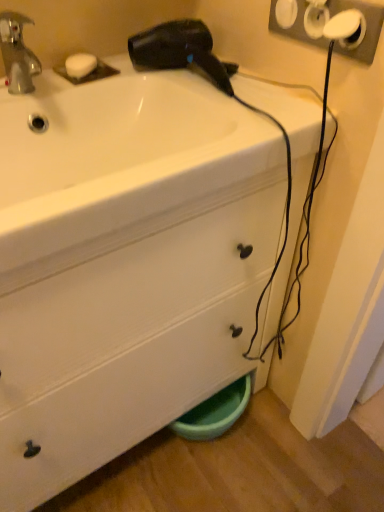
Question: In terms of width, does white plastic socket at upper right look wider or thinner when compared to white matte soap at upper left?

Choices:
 (A) wide
 (B) thin

Answer: (B)

Question: Based on their positions, is white plastic socket at upper right located to the left or right of white matte soap at upper left?

Choices:
 (A) right
 (B) left

Answer: (A)

Question: Which object is positioned closest to the white matte soap at upper left?

Choices:
 (A) white plastic socket at upper right
 (B) black plastic hair dryer at upper center

Answer: (B)

Question: Estimate the real-world distances between objects in this image. Which object is closer to the white matte soap at upper left?

Choices:
 (A) white plastic socket at upper right
 (B) black plastic hair dryer at upper center

Answer: (B)